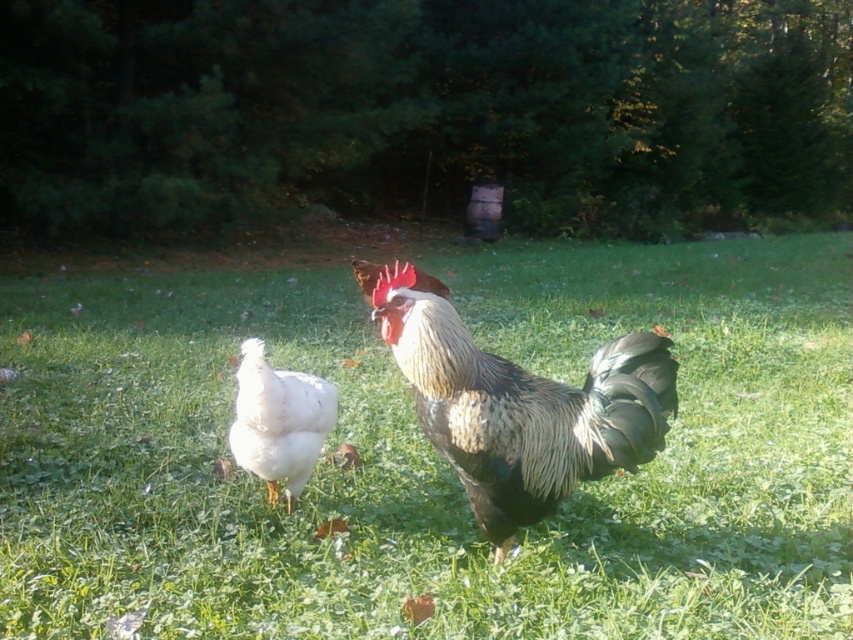
Question: Can you confirm if green grassy at center is thinner than white feathered chicken at center?

Choices:
 (A) no
 (B) yes

Answer: (A)

Question: Which object appears closest to the camera in this image?

Choices:
 (A) black and white feathered rooster at center
 (B) green grassy at center

Answer: (A)

Question: Which point is farther to the camera?

Choices:
 (A) black and white feathered rooster at center
 (B) white feathered chicken at center

Answer: (B)

Question: From the image, what is the correct spatial relationship of green grassy at center in relation to black and white feathered rooster at center?

Choices:
 (A) below
 (B) above

Answer: (A)

Question: Which object appears closest to the camera in this image?

Choices:
 (A) white feathered chicken at center
 (B) green grassy at center

Answer: (B)

Question: From the image, what is the correct spatial relationship of green grassy at center in relation to black and white feathered rooster at center?

Choices:
 (A) left
 (B) right

Answer: (B)